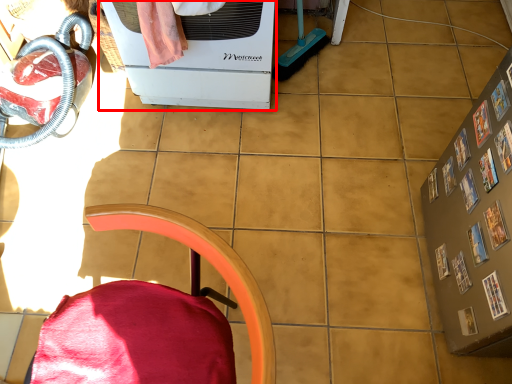
Question: From the image's perspective, what is the correct spatial positioning of home appliance (annotated by the red box) in reference to furniture?

Choices:
 (A) above
 (B) below

Answer: (A)